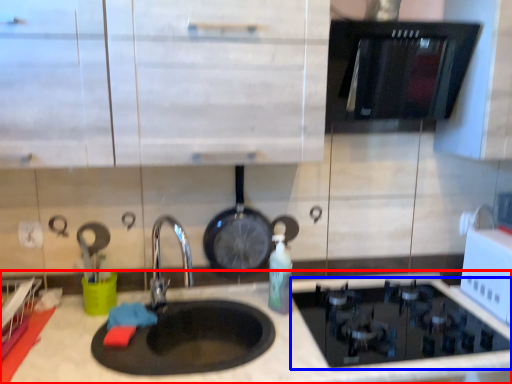
Question: Which object is further to the camera taking this photo, countertop (highlighted by a red box) or gas stove (highlighted by a blue box)?

Choices:
 (A) countertop
 (B) gas stove

Answer: (B)